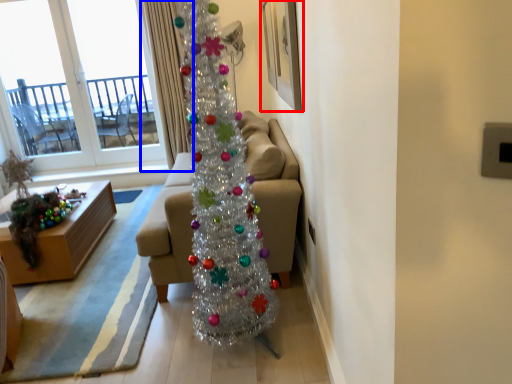
Question: Which point is closer to the camera, picture frame (highlighted by a red box) or curtain (highlighted by a blue box)?

Choices:
 (A) picture frame
 (B) curtain

Answer: (A)